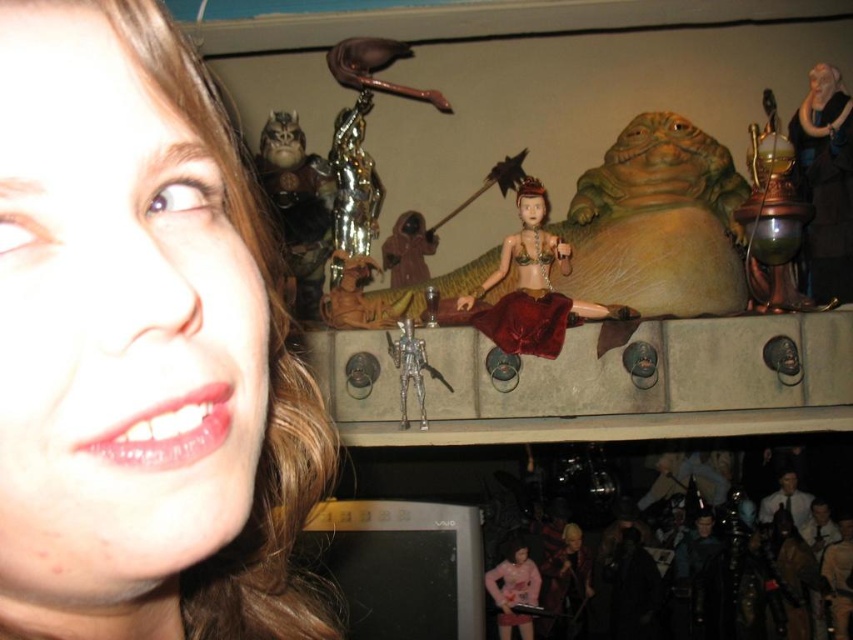
From the picture: You are organizing a display of toys and notice the shiny red fabric at center and the pink fabric doll at lower center. Which object is positioned higher in the arrangement?

The shiny red fabric at center is positioned higher than the pink fabric doll at lower center according to the description.

You are a photographer setting up a shoot. You have a matte skin at left and a pink fabric doll at lower center in your frame. Which object is wider in the image?

The pink fabric doll at lower center is wider than the matte skin at left.